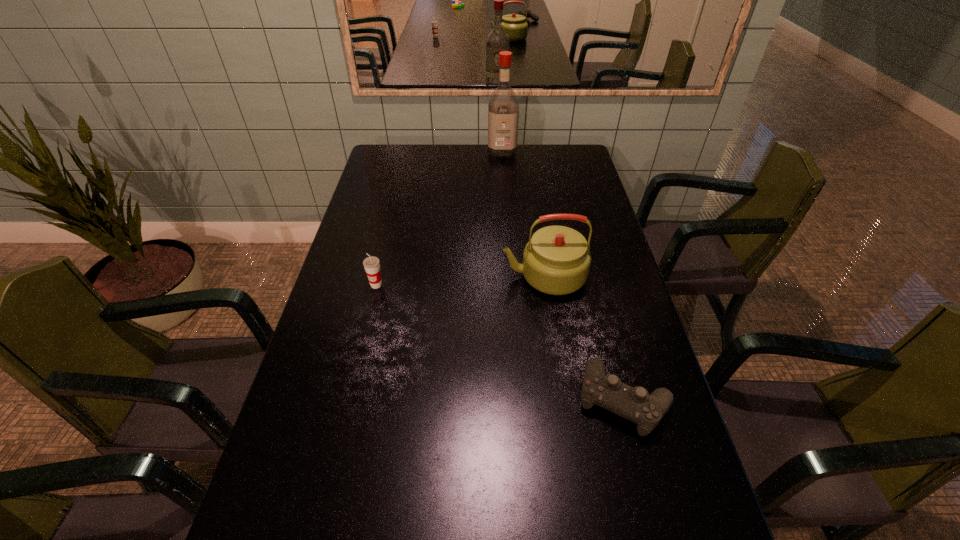
Find the location of a particular element. free space at the far right corner of the desktop is located at coordinates 574,149.

Locate an element on the screen. The image size is (960, 540). free spot between the second shortest object and the farthest object is located at coordinates (439, 218).

Where is `free space between the leftmost object and the control`? The height and width of the screenshot is (540, 960). free space between the leftmost object and the control is located at coordinates (500, 342).

In order to click on free area in between the third tallest object and the liquor in this screenshot , I will do `click(439, 218)`.

Identify the location of vacant area that lies between the farthest object and the kettle. (523, 213).

Locate an element on the screen. This screenshot has width=960, height=540. vacant space in between the second tallest object and the leftmost object is located at coordinates (460, 280).

At what (x,y) coordinates should I click in order to perform the action: click on empty location between the second tallest object and the liquor. Please return your answer as a coordinate pair (x, y). The height and width of the screenshot is (540, 960). Looking at the image, I should click on (523, 213).

Image resolution: width=960 pixels, height=540 pixels. I want to click on vacant area that lies between the third shortest object and the control, so click(x=584, y=338).

Locate which object is the third closest to the nearest object. Please provide its 2D coordinates. Your answer should be formatted as a tuple, i.e. [(x, y)], where the tuple contains the x and y coordinates of a point satisfying the conditions above.

[(503, 105)]

This screenshot has height=540, width=960. What are the coordinates of `object that is the second closest to the control` in the screenshot? It's located at (371, 264).